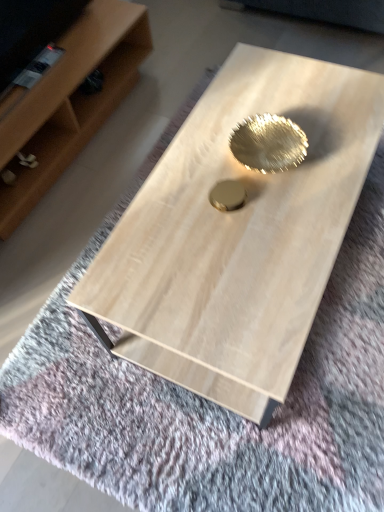
Question: Considering the positions of light wood coffee table at center and light wood shelf at upper left in the image, is light wood coffee table at center taller or shorter than light wood shelf at upper left?

Choices:
 (A) tall
 (B) short

Answer: (A)

Question: Looking at their shapes, would you say light wood coffee table at center is wider or thinner than light wood shelf at upper left?

Choices:
 (A) wide
 (B) thin

Answer: (A)

Question: Does point (236, 53) appear closer or farther from the camera than point (92, 36)?

Choices:
 (A) closer
 (B) farther

Answer: (A)

Question: From a real-world perspective, is light wood shelf at upper left above or below light wood coffee table at center?

Choices:
 (A) below
 (B) above

Answer: (A)

Question: Is light wood shelf at upper left inside or outside of light wood coffee table at center?

Choices:
 (A) outside
 (B) inside

Answer: (A)

Question: From the image's perspective, is light wood shelf at upper left located above or below light wood coffee table at center?

Choices:
 (A) above
 (B) below

Answer: (A)

Question: Looking at their shapes, would you say light wood shelf at upper left is wider or thinner than light wood coffee table at center?

Choices:
 (A) thin
 (B) wide

Answer: (A)